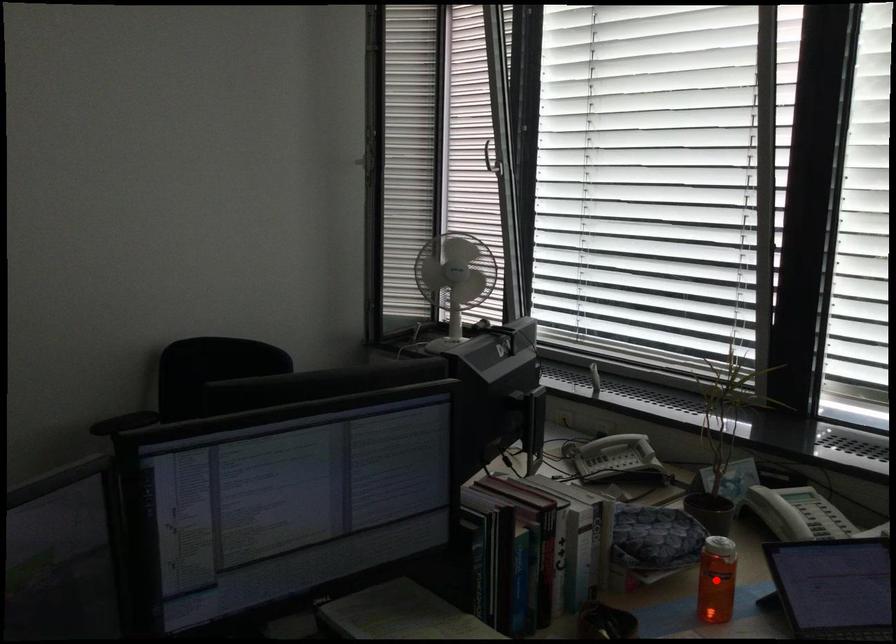
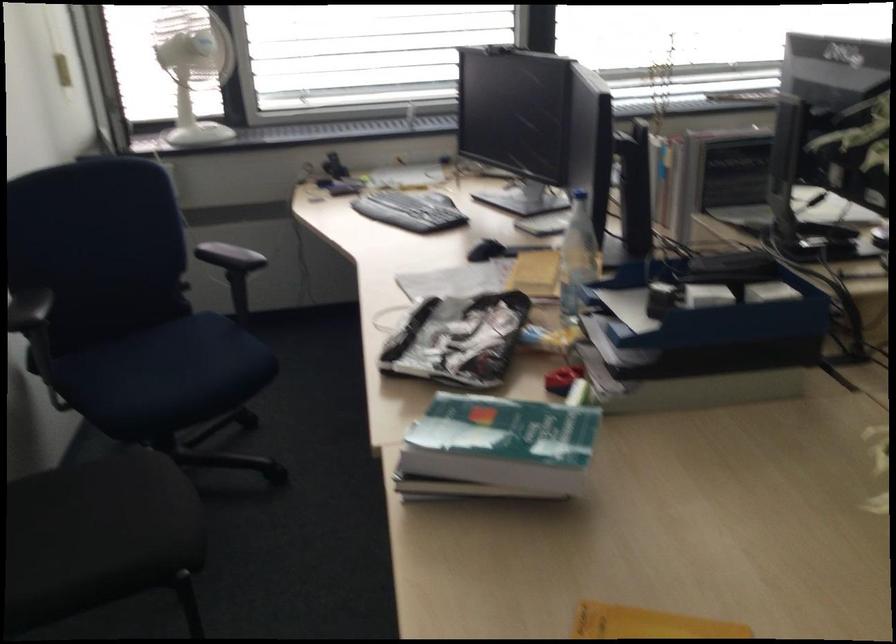
Question: I am providing you with two images of the same scene from different viewpoints. A red point is marked on the first image. Is the red point's position out of view in image 2?

Choices:
 (A) Yes
 (B) No

Answer: (A)